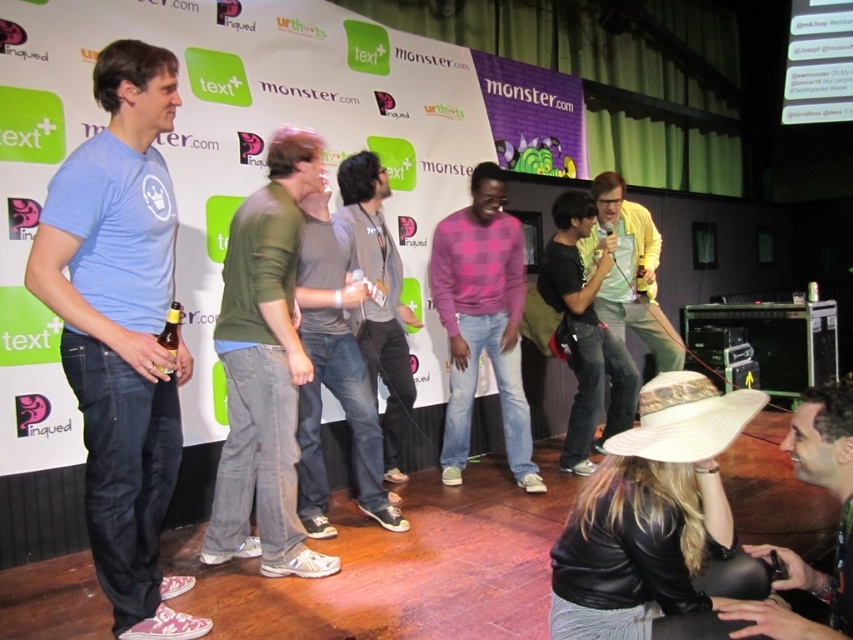
Question: From the image, what is the correct spatial relationship of pink checkered sweater at center in relation to brown matte bottle at center?

Choices:
 (A) right
 (B) left

Answer: (B)

Question: Does light blue t-shirt at left appear over brown matte bottle at center?

Choices:
 (A) yes
 (B) no

Answer: (B)

Question: Which object is the closest to the leather jacket at lower right?

Choices:
 (A) gray cotton shirt at center
 (B) gold metallic beer at center left
 (C) brown matte bottle at center

Answer: (B)

Question: Where is light blue t-shirt at left located in relation to gray cotton shirt at center in the image?

Choices:
 (A) left
 (B) right

Answer: (A)

Question: Which point is closer to the camera taking this photo?

Choices:
 (A) (273, 566)
 (B) (107, 444)

Answer: (B)

Question: Estimate the real-world distances between objects in this image. Which object is farther from the green cotton shirt at center?

Choices:
 (A) brown matte bottle at center
 (B) gray cotton shirt at center
 (C) yellow matte jacket at center

Answer: (A)